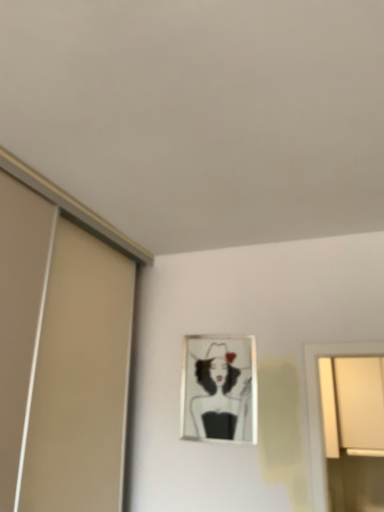
Question: In terms of width, does metallic silver picture frame at center look wider or thinner when compared to white matte window at upper right?

Choices:
 (A) thin
 (B) wide

Answer: (A)

Question: In terms of height, does metallic silver picture frame at center look taller or shorter compared to white matte window at upper right?

Choices:
 (A) tall
 (B) short

Answer: (B)

Question: From a real-world perspective, is metallic silver picture frame at center above or below white matte window at upper right?

Choices:
 (A) below
 (B) above

Answer: (B)

Question: From a real-world perspective, is white matte window at upper right positioned above or below metallic silver picture frame at center?

Choices:
 (A) below
 (B) above

Answer: (A)

Question: Is white matte window at upper right to the left or to the right of metallic silver picture frame at center in the image?

Choices:
 (A) right
 (B) left

Answer: (A)

Question: Considering the positions of white matte window at upper right and metallic silver picture frame at center in the image, is white matte window at upper right wider or thinner than metallic silver picture frame at center?

Choices:
 (A) wide
 (B) thin

Answer: (A)

Question: Considering the positions of white matte window at upper right and metallic silver picture frame at center in the image, is white matte window at upper right taller or shorter than metallic silver picture frame at center?

Choices:
 (A) short
 (B) tall

Answer: (B)